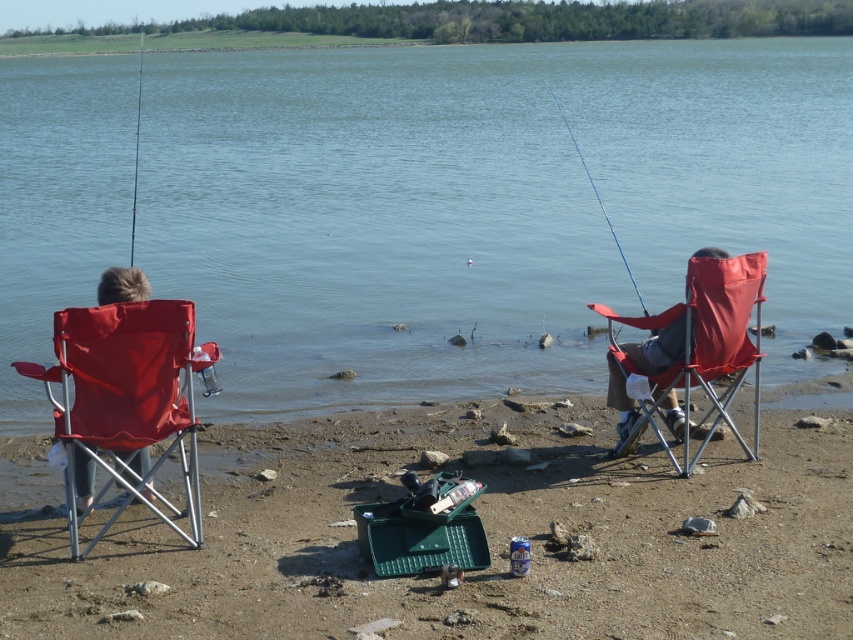
You are standing at the lakeside and want to place a small flag at the point that is closer to you. Which point should you choose between point (740,291) and point (131,234)?

Point (740,291) is closer to the camera than point (131,234), so you should choose point (740,291) to place the small flag.

You are standing on the lakeside shore and want to sit down. There is a clear blue water at center and a matte plastic beach chair at left. Which one is closer to you?

The matte plastic beach chair at left is behind the clear blue water at center, so the clear blue water at center is closer to you.

Based on the photo, you are standing on the lakeside shore and want to sit down to fish. There is a matte red folding chair at right and a metallic blue fishing pole at upper center. Which object should you move closer to the water to get a better fishing position?

You should move the matte red folding chair at right closer to the water because it is currently positioned to the right of the metallic blue fishing pole at upper center, which might be further away from the water edge.